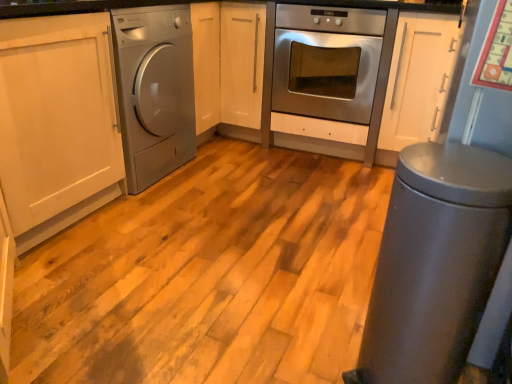
The image size is (512, 384). Identify the location of free space to the left of metallic gray trash can at lower right. (304, 354).